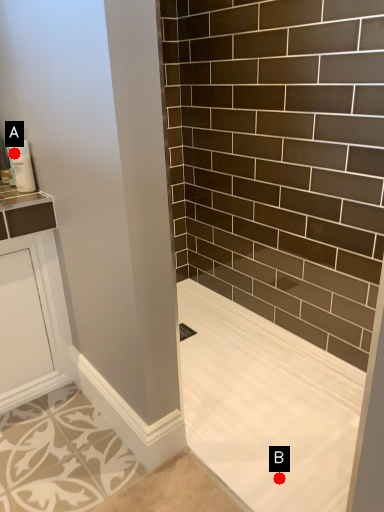
Question: Two points are circled on the image, labeled by A and B beside each circle. Which point is farther to the camera?

Choices:
 (A) A is further
 (B) B is further

Answer: (A)